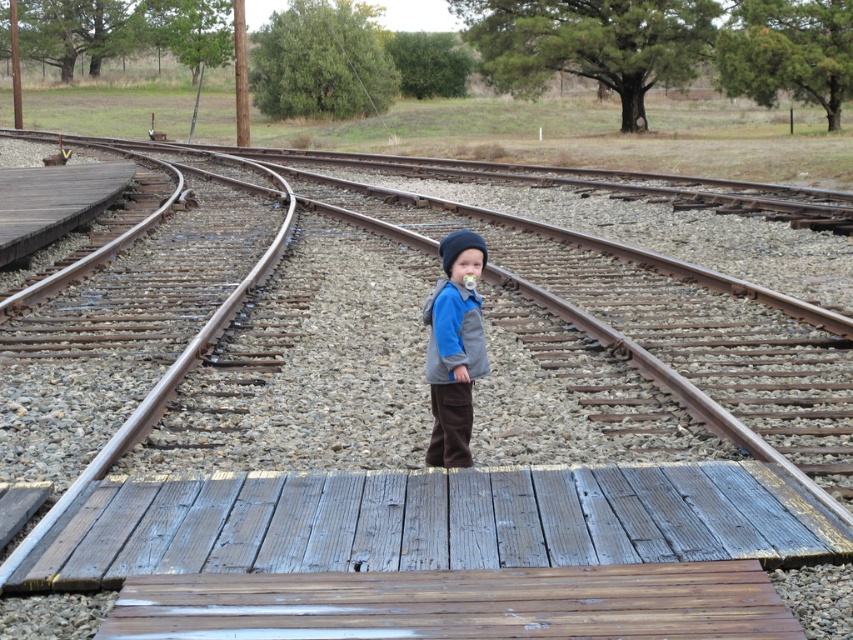
Does rusty metal track at center appear under brown suede vest at center?

No, rusty metal track at center is not below brown suede vest at center.

From the picture: Can you confirm if rusty metal track at center is shorter than brown suede vest at center?

Incorrect, rusty metal track at center's height does not fall short of brown suede vest at center's.

Is point (186, 493) closer to camera compared to point (433, 396)?

Yes, point (186, 493) is closer to viewer.

Identify the location of rusty metal track at center. (488, 460).